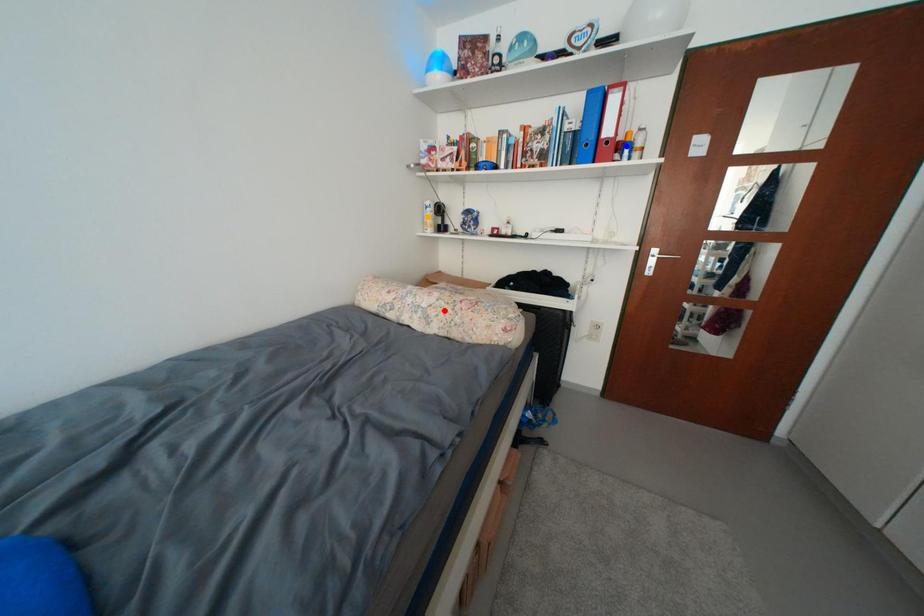
Order these from nearest to farthest:
A) blue point
B) orange point
C) red point

1. red point
2. blue point
3. orange point